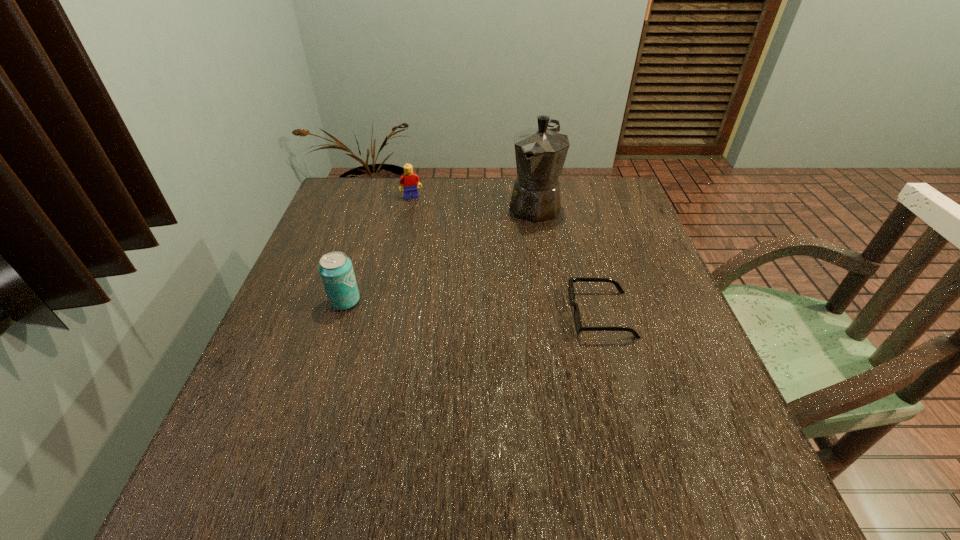
Where is `the leftmost object`? the leftmost object is located at coordinates (336, 271).

Locate an element on the screen. The height and width of the screenshot is (540, 960). sunglasses is located at coordinates (571, 291).

You are a GUI agent. You are given a task and a screenshot of the screen. Output one action in this format:
    pyautogui.click(x=<x>, y=<y>)
    Task: Click on the Lego
    
    Given the screenshot: What is the action you would take?
    click(x=410, y=181)

This screenshot has width=960, height=540. Identify the location of the tallest object. (540, 152).

This screenshot has height=540, width=960. In order to click on vacant space positioned 0.230m on the back of the beer can in this screenshot , I will do `click(367, 233)`.

At what (x,y) coordinates should I click in order to perform the action: click on free location located on the front-facing side of the shortest object. Please return your answer as a coordinate pair (x, y). Looking at the image, I should click on (414, 314).

Image resolution: width=960 pixels, height=540 pixels. I want to click on vacant space located 0.090m on the front-facing side of the shortest object, so click(530, 314).

Where is `free point located on the front-facing side of the shortest object`? The width and height of the screenshot is (960, 540). free point located on the front-facing side of the shortest object is located at coordinates (422, 314).

At what (x,y) coordinates should I click in order to perform the action: click on vacant space located on the face of the Lego. Please return your answer as a coordinate pair (x, y). Image resolution: width=960 pixels, height=540 pixels. Looking at the image, I should click on (420, 214).

The image size is (960, 540). What are the coordinates of `vacant region located 0.330m on the face of the Lego` in the screenshot? It's located at (441, 267).